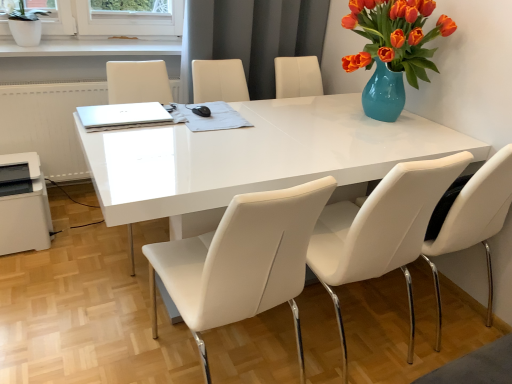
Question: Choose the correct answer: Is white leather chair at center, placed as the 2th chair when sorted from right to left, inside silver metallic laptop at upper left or outside it?

Choices:
 (A) outside
 (B) inside

Answer: (A)

Question: Considering the positions of point (396, 196) and point (130, 107), is point (396, 196) closer or farther from the camera than point (130, 107)?

Choices:
 (A) farther
 (B) closer

Answer: (B)

Question: Estimate the real-world distances between objects in this image. Which object is closer to the white ceramic pot at upper left?

Choices:
 (A) white leather chair at right, placed as the third chair when sorted from left to right
 (B) white leather chair at center, placed as the second chair when sorted from left to right
 (C) silver metallic laptop at upper left
 (D) white leather chair at center
 (E) white leather chair at center, positioned as the 3th chair in right-to-left order

Answer: (D)

Question: Which of these objects is positioned farthest from the white leather chair at right, placed as the third chair when sorted from left to right?

Choices:
 (A) silver metallic laptop at upper left
 (B) white plastic printer at lower left
 (C) white leather chair at center, placed as the second chair when sorted from left to right
 (D) white leather chair at center
 (E) white leather chair at center, positioned as the 3th chair in right-to-left order

Answer: (B)